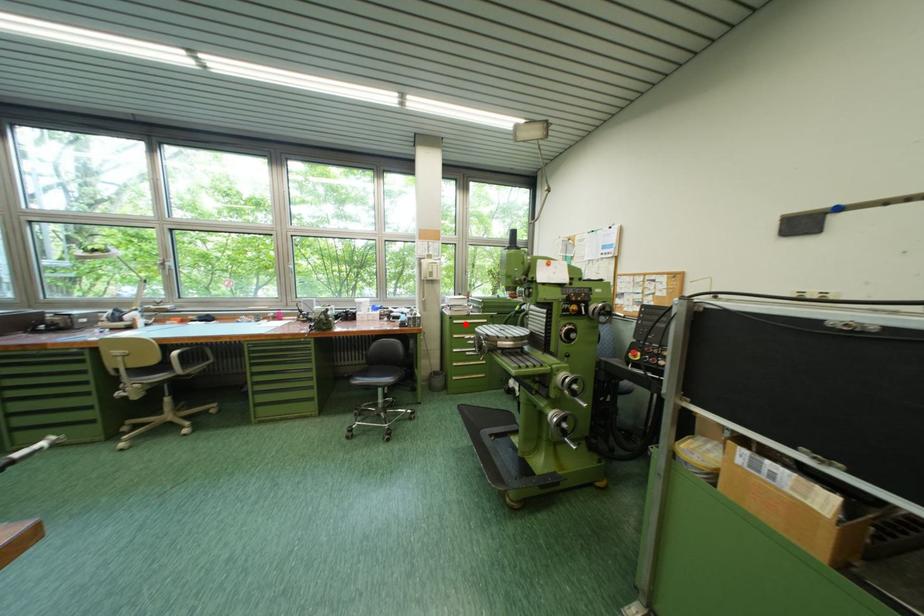
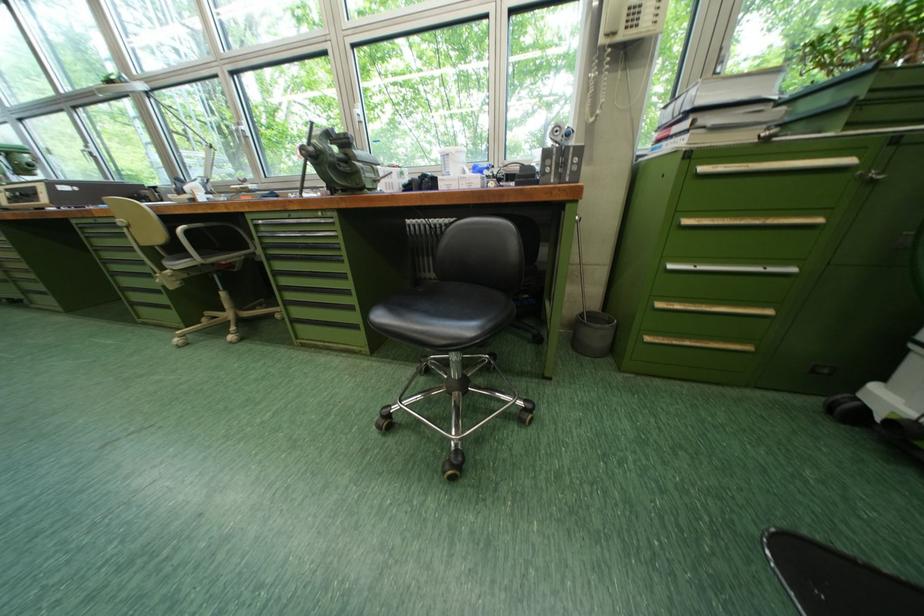
Where in the second image is the point corresponding to the highlighted location from the first image?

(713, 169)